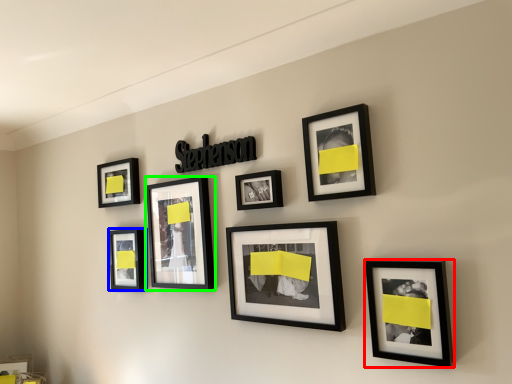
Question: Considering the real-world distances, which object is farthest from picture frame (highlighted by a red box)? picture frame (highlighted by a blue box) or picture frame (highlighted by a green box)?

Choices:
 (A) picture frame
 (B) picture frame

Answer: (A)